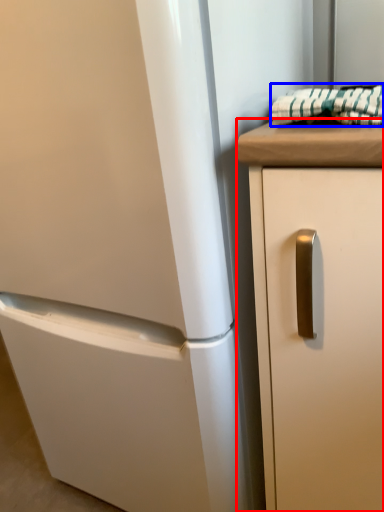
Question: Among these objects, which one is farthest to the camera, cabinetry (highlighted by a red box) or blanket (highlighted by a blue box)?

Choices:
 (A) cabinetry
 (B) blanket

Answer: (B)